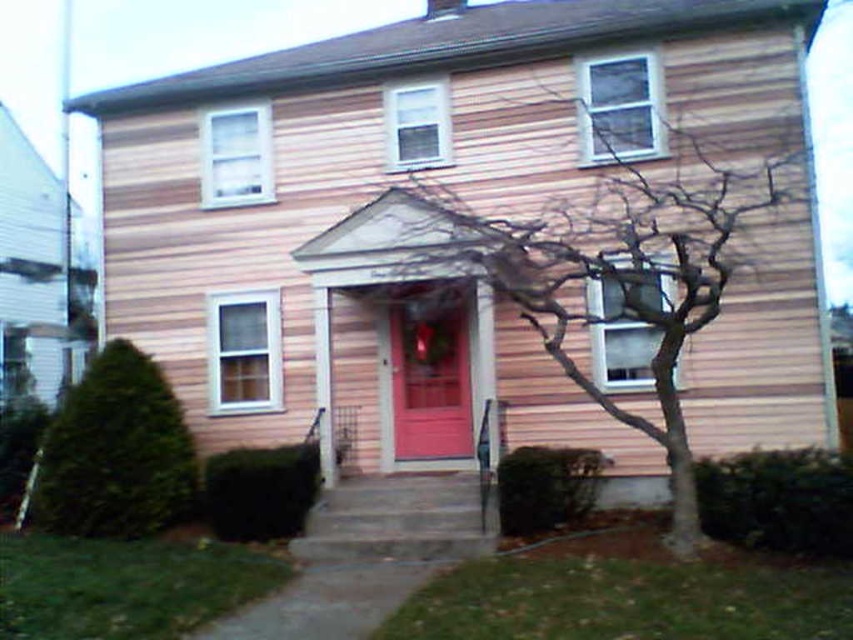
You are a window cleaner standing at the front of the house. You need to clean both the green leafy bush at lower left and the matte wood door at center. Which object requires you to use a ladder to reach its top?

The green leafy bush at lower left requires a ladder because it has a greater height compared to the matte wood door at center, so you need a ladder to reach its top.

A gardener wants to place a decorative statue between the bare branches at center and the green leafy bush at lower left. If the statue requires a space of 5 meters to be placed safely, will there be enough space?

The distance between the bare branches at center and the green leafy bush at lower left is 4.94 meters, which is slightly less than the required 5 meters. Therefore, there isn not enough space to safely place the statue.

Consider the image. You are standing in front of the house and notice the bare branches at center and the green leafy bush at lower left. Which object is located above the other?

The bare branches at center is positioned over the green leafy bush at lower left.